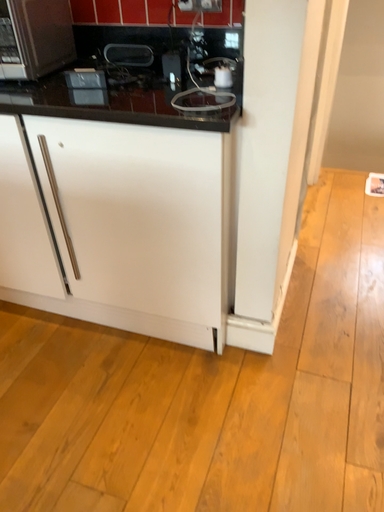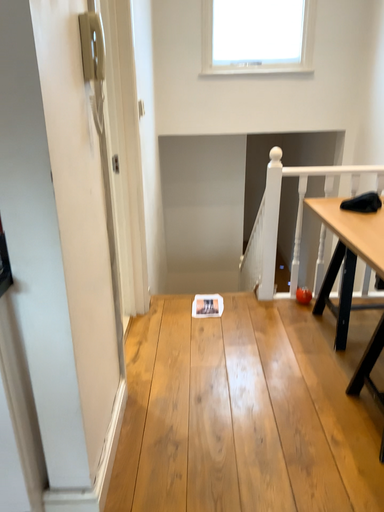
Question: Which way did the camera rotate in the video?

Choices:
 (A) rotated right
 (B) rotated left

Answer: (A)